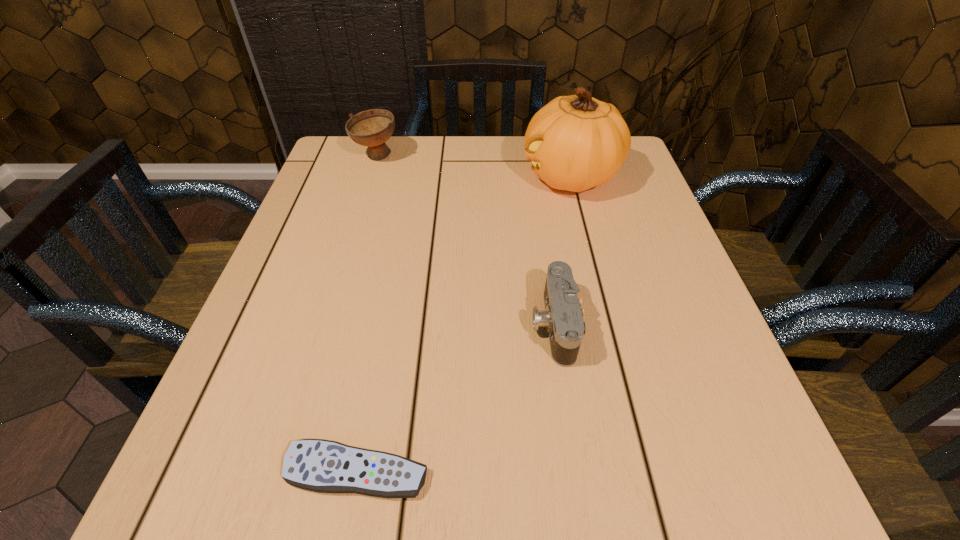
Locate an element on the screen. Image resolution: width=960 pixels, height=540 pixels. vacant space at the near right corner of the desktop is located at coordinates (696, 496).

You are a GUI agent. You are given a task and a screenshot of the screen. Output one action in this format:
    pyautogui.click(x=<x>, y=<y>)
    Task: Click on the free space between the pumpkin and the third farthest object
    
    Given the screenshot: What is the action you would take?
    pyautogui.click(x=563, y=251)

What are the coordinates of `empty space that is in between the second tallest object and the shortest object` in the screenshot? It's located at (366, 314).

Find the location of a particular element. free space between the third tallest object and the pumpkin is located at coordinates pos(563,251).

At what (x,y) coordinates should I click in order to perform the action: click on vacant space in between the nearest object and the soup bowl. Please return your answer as a coordinate pair (x, y). Looking at the image, I should click on (366, 314).

Where is `vacant space in between the camera and the remote control`? The image size is (960, 540). vacant space in between the camera and the remote control is located at coordinates (455, 397).

This screenshot has width=960, height=540. What are the coordinates of `empty space between the second nearest object and the remote control` in the screenshot? It's located at (455, 397).

Identify the location of empty space between the third tallest object and the shortest object. Image resolution: width=960 pixels, height=540 pixels. (455, 397).

Where is `empty space between the second shortest object and the second tallest object`? Image resolution: width=960 pixels, height=540 pixels. empty space between the second shortest object and the second tallest object is located at coordinates (465, 240).

I want to click on free space that is in between the pumpkin and the third shortest object, so click(x=473, y=167).